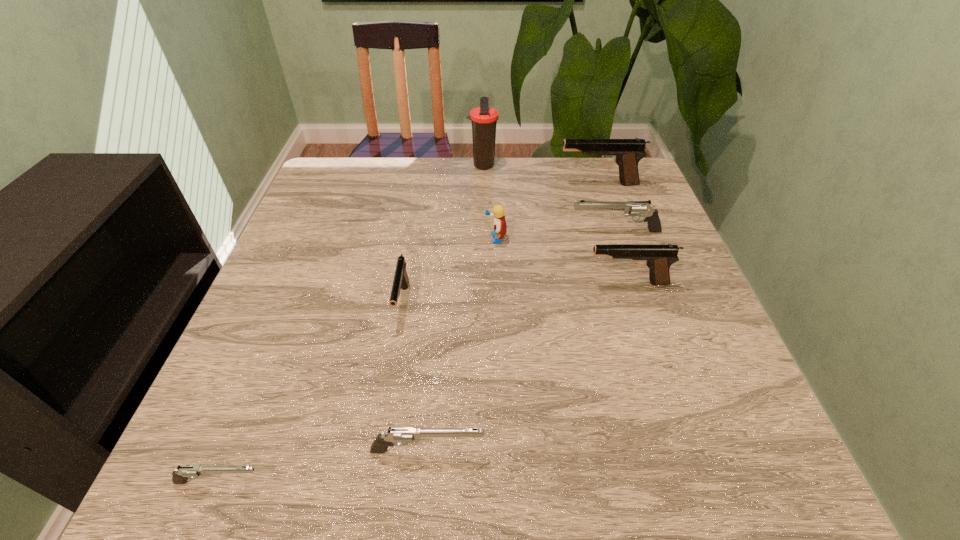
You are a GUI agent. You are given a task and a screenshot of the screen. Output one action in this format:
    pyautogui.click(x=<x>, y=<y>)
    Task: Click on the second silver pistol from left to right
    This screenshot has height=540, width=960.
    Given the screenshot: What is the action you would take?
    pyautogui.click(x=399, y=436)

Identify the location of the nearest pistol. Image resolution: width=960 pixels, height=540 pixels. (180, 475).

Identify the location of the leftmost pistol. (180, 475).

Locate an element on the screen. Image resolution: width=960 pixels, height=540 pixels. vacant space situated on the right of the thermos bottle is located at coordinates (571, 165).

The image size is (960, 540). I want to click on free point located 0.210m at the muzzle of the tallest pistol, so click(x=483, y=184).

This screenshot has width=960, height=540. I want to click on free location located at the muzzle of the tallest pistol, so click(497, 184).

Locate an element on the screen. This screenshot has width=960, height=540. vacant space positioned 0.300m at the muzzle of the tallest pistol is located at coordinates (451, 184).

Find the location of a particular element. vacant space located at the muzzle of the fifth shortest pistol is located at coordinates (412, 284).

I want to click on vacant region located at the muzzle of the fifth shortest pistol, so click(x=412, y=284).

The image size is (960, 540). Identify the location of free region located at the muzzle of the fifth shortest pistol. (508, 284).